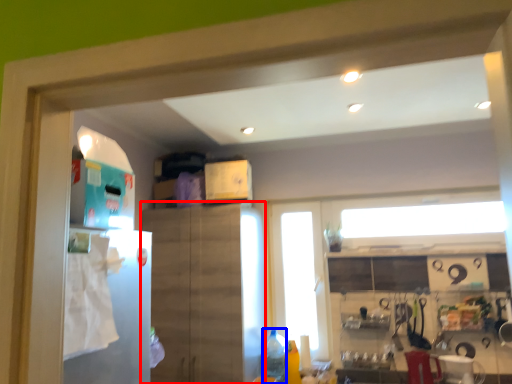
Question: Which object appears farthest to the camera in this image, cabinetry (highlighted by a red box) or bottle (highlighted by a blue box)?

Choices:
 (A) cabinetry
 (B) bottle

Answer: (B)